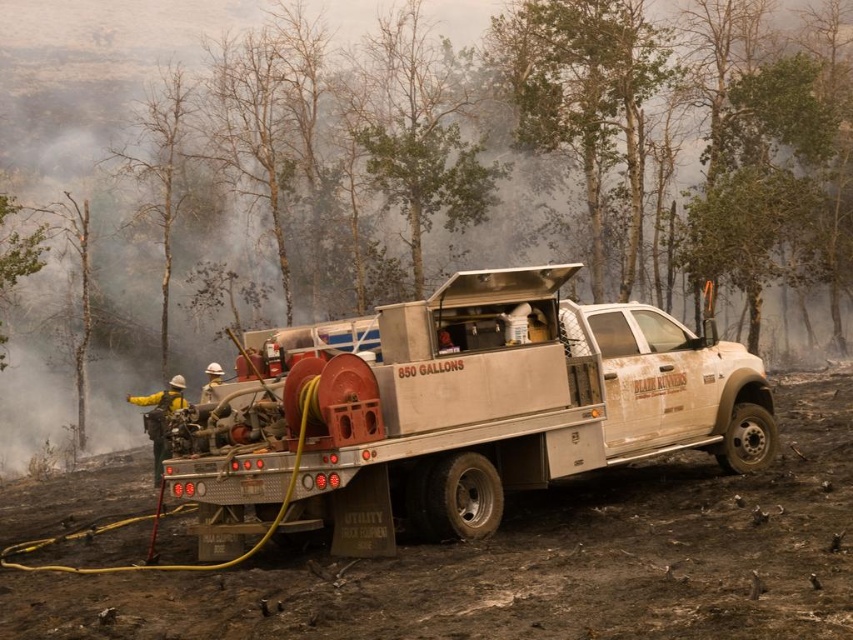
Question: Does green leafy tree at center have a lesser width compared to white matte utility truck at center?

Choices:
 (A) yes
 (B) no

Answer: (B)

Question: Which point is closer to the camera?

Choices:
 (A) (570, 140)
 (B) (700, 429)
 (C) (154, 406)

Answer: (B)

Question: Is green leafy tree at center wider than white matte utility truck at center?

Choices:
 (A) yes
 (B) no

Answer: (A)

Question: Which object is farther from the camera taking this photo?

Choices:
 (A) white matte utility truck at center
 (B) green leafy tree at center

Answer: (B)

Question: Observing the image, what is the correct spatial positioning of white matte utility truck at center in reference to yellow reflective jacket at center?

Choices:
 (A) right
 (B) left

Answer: (A)

Question: Among these objects, which one is nearest to the camera?

Choices:
 (A) green leafy tree at center
 (B) white matte utility truck at center
 (C) yellow reflective jacket at center

Answer: (B)